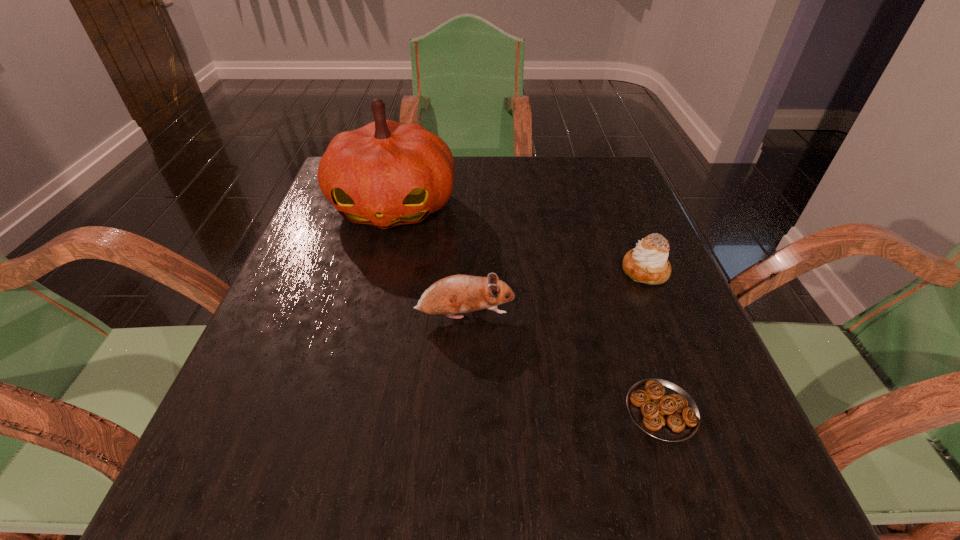
Locate an element on the screen. Image resolution: width=960 pixels, height=540 pixels. vacant region that satisfies the following two spatial constraints: 1. on the front-facing side of the farthest object; 2. on the left side of the nearer pastry is located at coordinates (342, 410).

Image resolution: width=960 pixels, height=540 pixels. In order to click on vacant region that satisfies the following two spatial constraints: 1. on the front-facing side of the third nearest object; 2. on the left side of the tallest object in this screenshot , I will do `click(377, 271)`.

The image size is (960, 540). In order to click on free spot that satisfies the following two spatial constraints: 1. on the front-facing side of the farthest object; 2. on the right side of the second farthest object in this screenshot , I will do `click(377, 271)`.

You are a GUI agent. You are given a task and a screenshot of the screen. Output one action in this format:
    pyautogui.click(x=<x>, y=<y>)
    Task: Click on the free location that satisfies the following two spatial constraints: 1. on the front-facing side of the tallest object; 2. on the left side of the nearer pastry
    The height and width of the screenshot is (540, 960).
    Given the screenshot: What is the action you would take?
    pyautogui.click(x=342, y=410)

I want to click on vacant space that satisfies the following two spatial constraints: 1. on the front-facing side of the farther pastry; 2. on the right side of the pumpkin, so click(x=377, y=271).

You are a GUI agent. You are given a task and a screenshot of the screen. Output one action in this format:
    pyautogui.click(x=<x>, y=<y>)
    Task: Click on the free spot that satisfies the following two spatial constraints: 1. on the front-facing side of the nearer pastry; 2. on the left side of the pumpkin
    
    Given the screenshot: What is the action you would take?
    click(342, 410)

Locate an element on the screen. The width and height of the screenshot is (960, 540). vacant point that satisfies the following two spatial constraints: 1. at the face of the nearest object; 2. on the left side of the third farthest object is located at coordinates (462, 410).